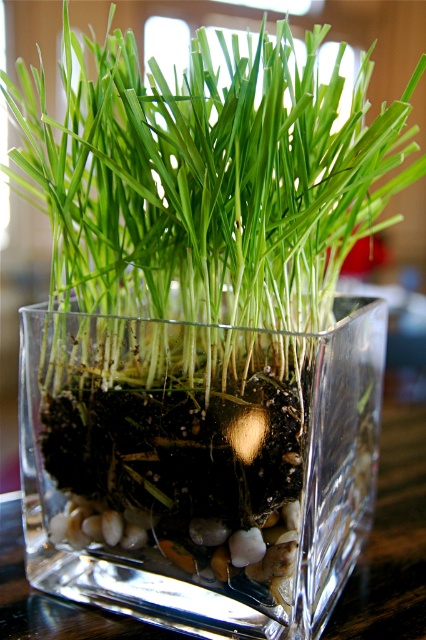
Does transparent glass cube at center have a greater width compared to green matte grass at center?

In fact, transparent glass cube at center might be narrower than green matte grass at center.

Does transparent glass cube at center have a lesser height compared to green matte grass at center?

Indeed, transparent glass cube at center has a lesser height compared to green matte grass at center.

Identify the location of transparent glass cube at center. (198, 464).